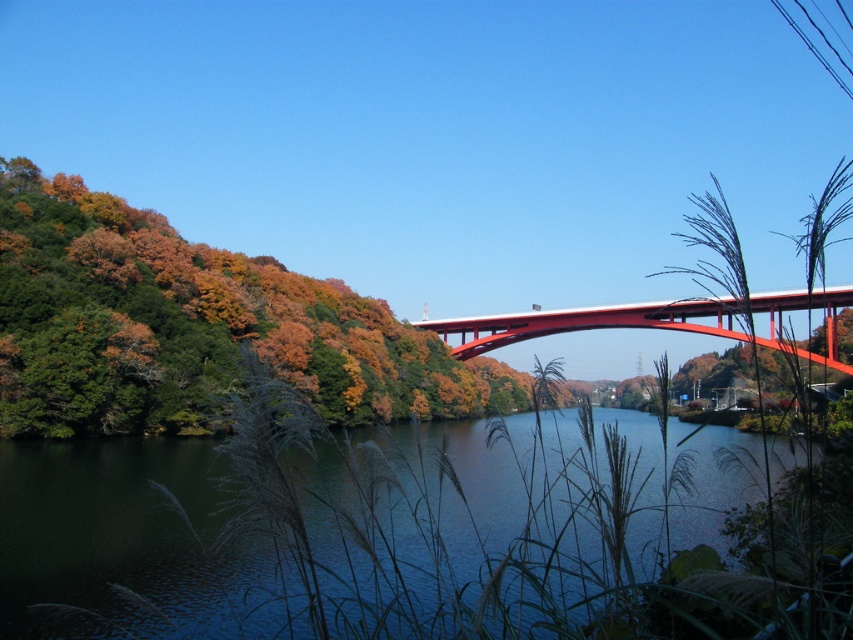
You are standing at the point marked as point (126, 544). What do you see directly below you?

At point (126, 544) lies dark blue water at center.

You are an artist planning to paint the scene. You want to ensure the autumn leaves at left and metallic red bridge at center are proportionally accurate. Which object should you paint wider in your artwork?

The autumn leaves at left should be painted wider because their width is larger than the metallic red bridge at center.